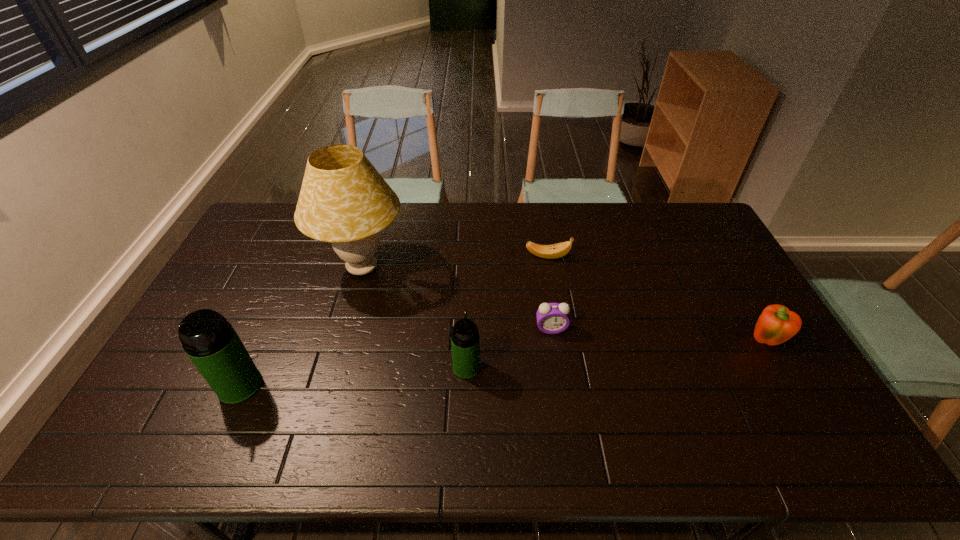
The width and height of the screenshot is (960, 540). What are the coordinates of `free space at the far edge` in the screenshot? It's located at (387, 238).

In the image, there is a desktop. Where is `vacant space at the near edge`? vacant space at the near edge is located at coordinates (261, 410).

This screenshot has height=540, width=960. In the image, there is a desktop. What are the coordinates of `free space at the left edge` in the screenshot? It's located at (269, 259).

In the image, there is a desktop. Where is `vacant space at the right edge`? This screenshot has width=960, height=540. vacant space at the right edge is located at coordinates (743, 302).

In the image, there is a desktop. Identify the location of blank space at the far left corner. (291, 224).

Locate an element on the screen. empty space between the alarm clock and the shorter thermos bottle is located at coordinates (509, 348).

Image resolution: width=960 pixels, height=540 pixels. What are the coordinates of `free space between the pepper and the left thermos bottle` in the screenshot? It's located at (502, 364).

I want to click on free space that is in between the alarm clock and the banana, so click(x=549, y=293).

The height and width of the screenshot is (540, 960). Identify the location of free space between the banana and the third tallest object. (507, 312).

The width and height of the screenshot is (960, 540). Identify the location of empty location between the right thermos bottle and the second object from left to right. (415, 318).